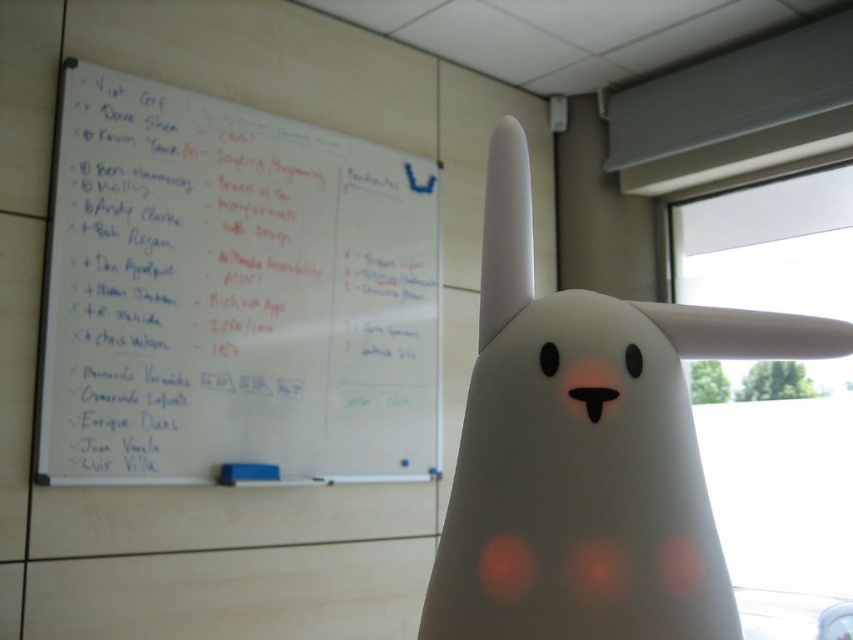
Question: Which object appears closest to the camera in this image?

Choices:
 (A) white matte eraser at center
 (B) white matte whiteboard at upper left

Answer: (B)

Question: Can you confirm if white matte whiteboard at upper left is wider than white matte eraser at center?

Choices:
 (A) yes
 (B) no

Answer: (A)

Question: Can you confirm if white matte whiteboard at upper left is positioned to the left of white matte eraser at center?

Choices:
 (A) no
 (B) yes

Answer: (A)

Question: Which point is closer to the camera?

Choices:
 (A) white matte eraser at center
 (B) white matte whiteboard at upper left

Answer: (B)

Question: Does white matte whiteboard at upper left appear on the left side of white matte eraser at center?

Choices:
 (A) no
 (B) yes

Answer: (A)